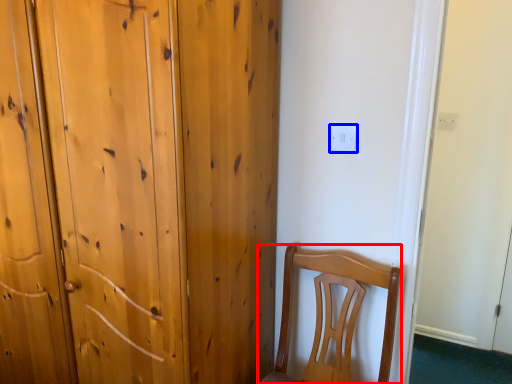
Question: Which point is closer to the camera, chair (highlighted by a red box) or electric outlet (highlighted by a blue box)?

Choices:
 (A) chair
 (B) electric outlet

Answer: (A)